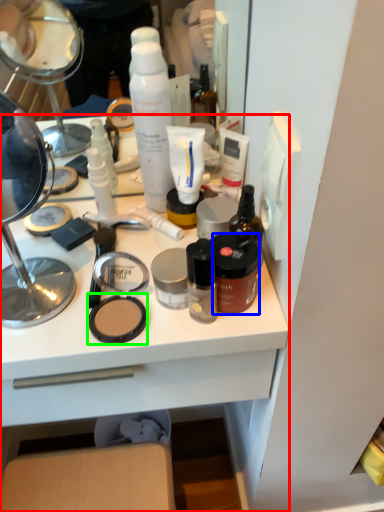
Question: Estimate the real-world distances between objects in this image. Which object is closer to desk (highlighted by a red box), toiletry (highlighted by a blue box) or face powder (highlighted by a green box)?

Choices:
 (A) toiletry
 (B) face powder

Answer: (B)